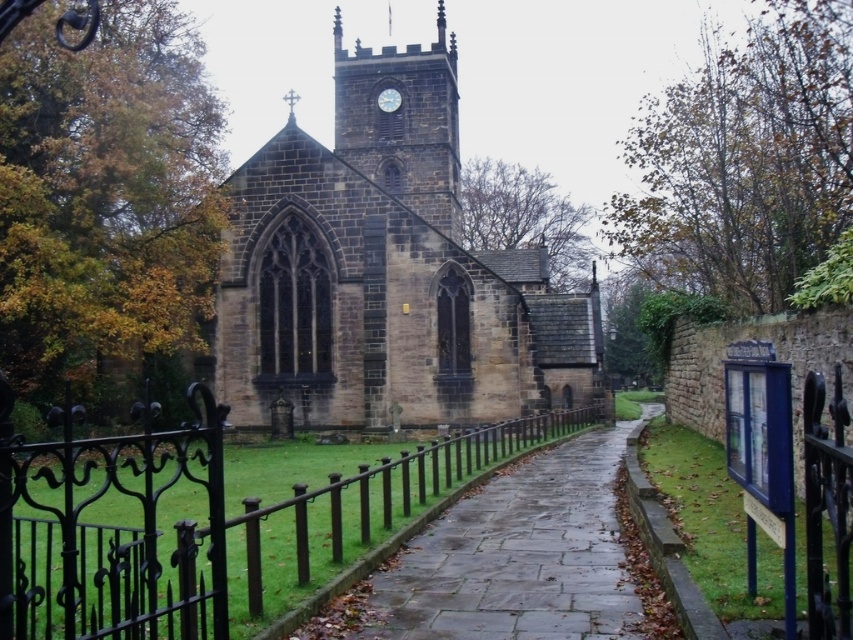
Question: Based on their relative distances, which object is nearer to the paved stone path at center?

Choices:
 (A) black wrought iron fence at center
 (B) white stone clock at upper center
 (C) dark stone church at center

Answer: (A)

Question: Which of the following is the farthest from the observer?

Choices:
 (A) (379, 106)
 (B) (125, 586)

Answer: (A)

Question: Does dark stone church at center have a greater width compared to paved stone path at center?

Choices:
 (A) yes
 (B) no

Answer: (A)

Question: Which of the following is the farthest from the observer?

Choices:
 (A) (422, 124)
 (B) (611, 444)

Answer: (A)

Question: Is paved stone path at center thinner than white stone clock at upper center?

Choices:
 (A) yes
 (B) no

Answer: (B)

Question: Does dark stone church at center have a smaller size compared to black wrought iron fence at center?

Choices:
 (A) no
 (B) yes

Answer: (A)